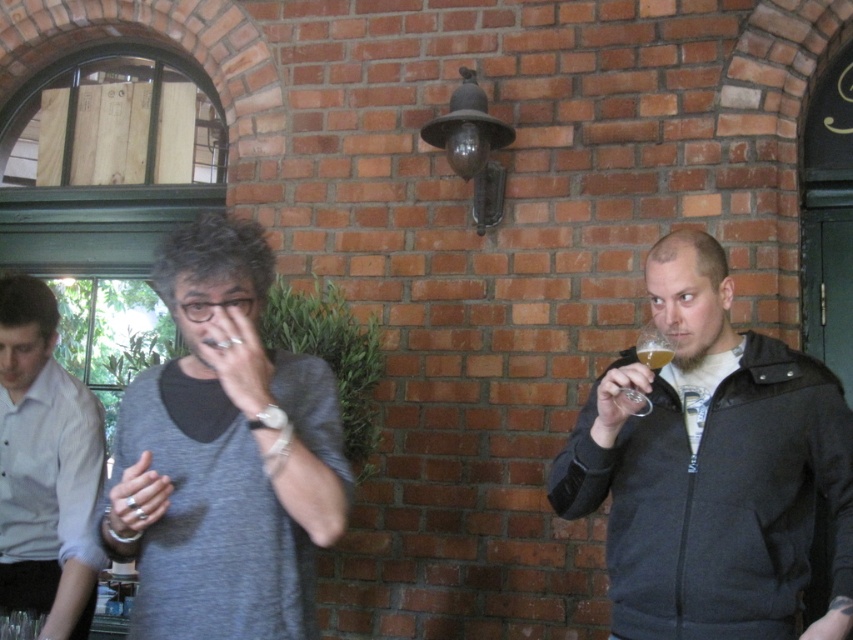
You are at a party and want to pour wine into the clear glass wine glass at right and the translucent glass at right. Which glass can hold more wine?

The clear glass wine glass at right can hold more wine because it has a larger size compared to the translucent glass at right.